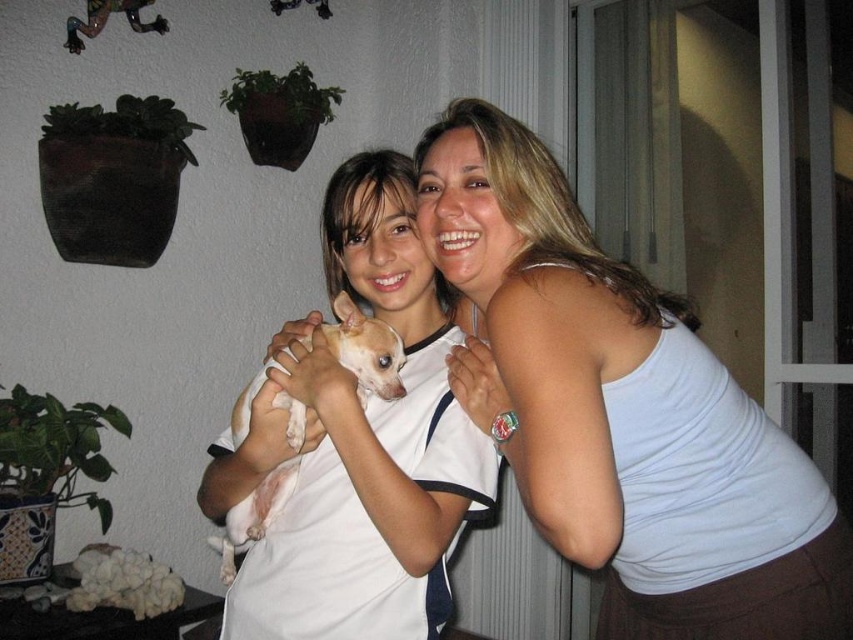
Consider the image. Does white tank top at upper right have a greater height compared to white soft fur dog at center?

Indeed, white tank top at upper right has a greater height compared to white soft fur dog at center.

Who is taller, white tank top at upper right or white soft fur dog at center?

With more height is white tank top at upper right.

You are a GUI agent. You are given a task and a screenshot of the screen. Output one action in this format:
    pyautogui.click(x=<x>, y=<y>)
    Task: Click on the white tank top at upper right
    
    Given the screenshot: What is the action you would take?
    pyautogui.click(x=619, y=410)

Does point (683, 470) come closer to viewer compared to point (345, 461)?

Yes, it is.

Between white tank top at upper right and white soft fabric shirt at center, which one appears on the right side from the viewer's perspective?

Positioned to the right is white tank top at upper right.

Is point (503, 298) more distant than point (428, 560)?

No, (503, 298) is closer to viewer.

Find the location of a particular element. The height and width of the screenshot is (640, 853). white tank top at upper right is located at coordinates (619, 410).

Who is more forward, (x=450, y=416) or (x=357, y=356)?

Point (x=357, y=356)

Is white soft fabric shirt at center shorter than white soft fur dog at center?

No, white soft fabric shirt at center is not shorter than white soft fur dog at center.

Between point (264, 468) and point (347, 301), which one is positioned in front?

Positioned in front is point (264, 468).

You are a GUI agent. You are given a task and a screenshot of the screen. Output one action in this format:
    pyautogui.click(x=<x>, y=<y>)
    Task: Click on the white soft fabric shirt at center
    The image size is (853, 640).
    Given the screenshot: What is the action you would take?
    pyautogui.click(x=361, y=448)